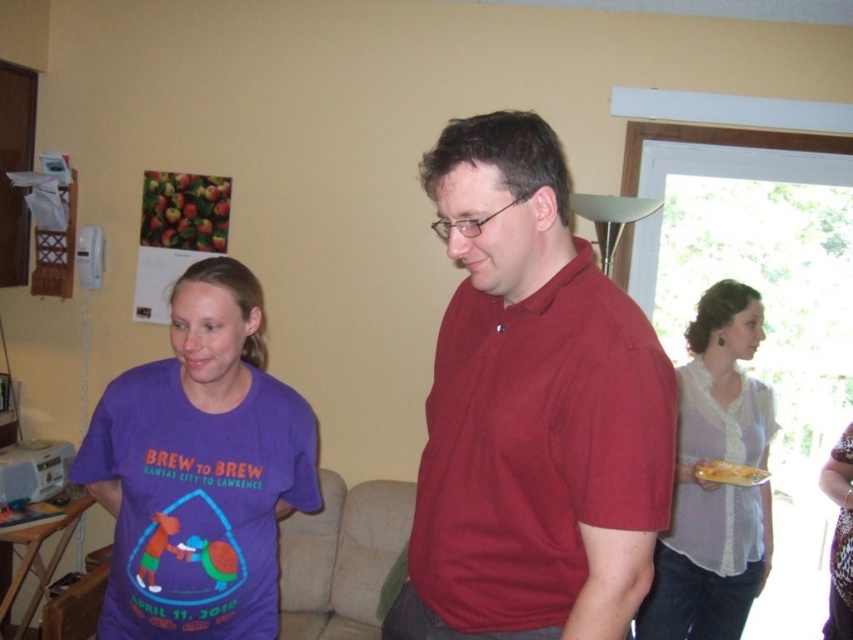
You are standing in the room and want to determine which of the two points, point [585,289] or point [181,452], is nearer to you. Based on the scene description, which point is closer?

Point [585,289] is closer to the camera than point [181,452], so it is the nearer one.